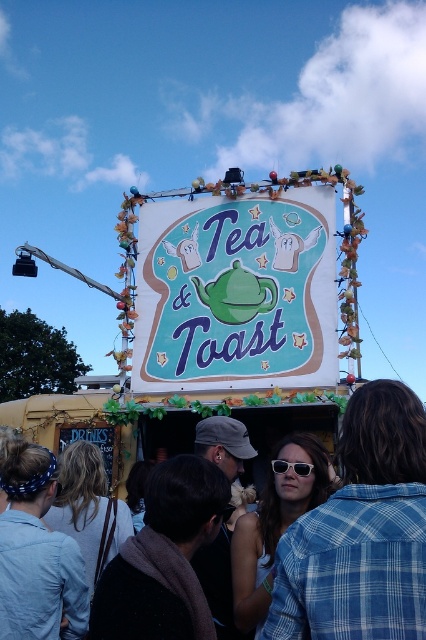
Question: Estimate the real-world distances between objects in this image. Which object is farther from the denim jacket at lower right?

Choices:
 (A) white plastic sunglasses at center
 (B) teal fabric sign at center

Answer: (B)

Question: Among these points, which one is nearest to the camera?

Choices:
 (A) (305, 476)
 (B) (374, 428)

Answer: (B)

Question: Does denim jacket at lower right appear under white plastic sunglasses at center?

Choices:
 (A) no
 (B) yes

Answer: (B)

Question: Observing the image, what is the correct spatial positioning of teal fabric sign at center in reference to white plastic sunglasses at center?

Choices:
 (A) above
 (B) below

Answer: (A)

Question: Based on their relative distances, which object is nearer to the denim jacket at lower right?

Choices:
 (A) white plastic sunglasses at center
 (B) teal fabric sign at center

Answer: (A)

Question: Observing the image, what is the correct spatial positioning of teal fabric sign at center in reference to denim jacket at lower right?

Choices:
 (A) left
 (B) right

Answer: (A)